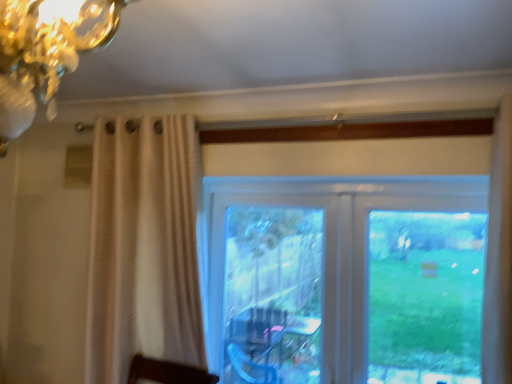
Question: Based on their sizes in the image, would you say transparent glass window at center is bigger or smaller than transparent glass screen door at center?

Choices:
 (A) big
 (B) small

Answer: (A)

Question: Considering the relative positions of transparent glass window at center and transparent glass screen door at center in the image provided, is transparent glass window at center to the left or to the right of transparent glass screen door at center?

Choices:
 (A) left
 (B) right

Answer: (B)

Question: In terms of width, does transparent glass window at center look wider or thinner when compared to transparent glass screen door at center?

Choices:
 (A) wide
 (B) thin

Answer: (A)

Question: Considering the positions of transparent glass screen door at center and transparent glass window at center in the image, is transparent glass screen door at center wider or thinner than transparent glass window at center?

Choices:
 (A) wide
 (B) thin

Answer: (B)

Question: Is point tap(279, 198) positioned closer to the camera than point tap(394, 301)?

Choices:
 (A) closer
 (B) farther

Answer: (B)

Question: From a real-world perspective, is transparent glass screen door at center physically located above or below transparent glass window at center?

Choices:
 (A) below
 (B) above

Answer: (A)

Question: From the image's perspective, is transparent glass screen door at center above or below transparent glass window at center?

Choices:
 (A) above
 (B) below

Answer: (B)